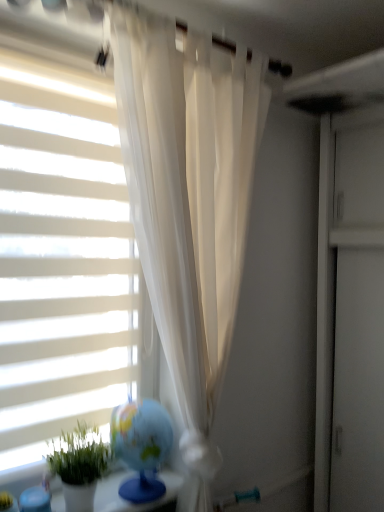
This screenshot has height=512, width=384. Describe the element at coordinates (61, 259) in the screenshot. I see `white matte window blind at left` at that location.

The height and width of the screenshot is (512, 384). Find the location of `white matte window blind at left`. white matte window blind at left is located at coordinates (61, 259).

Locate an element on the screen. green matte plant at lower left is located at coordinates (78, 466).

Image resolution: width=384 pixels, height=512 pixels. What do you see at coordinates (78, 466) in the screenshot? I see `green matte plant at lower left` at bounding box center [78, 466].

In order to face green matte plant at lower left, should I rotate leftwards or rightwards?

It's best to rotate left around 14.726 degrees.

The height and width of the screenshot is (512, 384). Find the location of `white matte window blind at left`. white matte window blind at left is located at coordinates (61, 259).

Visually, is white matte window blind at left positioned to the left or to the right of green matte plant at lower left?

Clearly, white matte window blind at left is on the left of green matte plant at lower left in the image.

Is white matte window blind at left in front of green matte plant at lower left?

No, it is not.

Is point (101, 157) closer or farther from the camera than point (110, 451)?

Point (101, 157) appears to be farther away from the viewer than point (110, 451).

From the image's perspective, which object appears higher, white matte window blind at left or green matte plant at lower left?

white matte window blind at left.

From a real-world perspective, which object rests below the other?

green matte plant at lower left is physically lower.

Is white matte window blind at left wider than green matte plant at lower left?

In fact, white matte window blind at left might be narrower than green matte plant at lower left.

Is white matte window blind at left taller than green matte plant at lower left?

Yes, white matte window blind at left is taller than green matte plant at lower left.

Between white matte window blind at left and green matte plant at lower left, which one has smaller size?

Smaller between the two is green matte plant at lower left.

Is green matte plant at lower left a part of white matte window blind at left?

Actually, green matte plant at lower left is outside white matte window blind at left.

Is white matte window blind at left far from green matte plant at lower left?

white matte window blind at left is actually quite close to green matte plant at lower left.

Does white matte window blind at left turn towards green matte plant at lower left?

Yes, white matte window blind at left is facing green matte plant at lower left.

From the picture: What's the angular difference between white matte window blind at left and green matte plant at lower left's facing directions?

0.484 degrees.

Where is `window blind that appears above the green matte plant at lower left (from a real-world perspective)`? The width and height of the screenshot is (384, 512). window blind that appears above the green matte plant at lower left (from a real-world perspective) is located at coordinates (61, 259).

Which object is positioned more to the right, green matte plant at lower left or white matte window blind at left?

Positioned to the right is green matte plant at lower left.

Which object is further away from the camera, green matte plant at lower left or white matte window blind at left?

white matte window blind at left.

Does point (72, 472) appear closer or farther from the camera than point (107, 262)?

Point (72, 472).

From the image's perspective, is green matte plant at lower left located beneath white matte window blind at left?

Indeed, from the image's perspective, green matte plant at lower left is shown beneath white matte window blind at left.

From a real-world perspective, is green matte plant at lower left located higher than white matte window blind at left?

Incorrect, from a real-world perspective, green matte plant at lower left is lower than white matte window blind at left.

Is green matte plant at lower left thinner than white matte window blind at left?

No.

Is green matte plant at lower left taller or shorter than white matte window blind at left?

green matte plant at lower left is shorter than white matte window blind at left.

Is green matte plant at lower left smaller than white matte window blind at left?

Yes.

Would you say white matte window blind at left is part of green matte plant at lower left's contents?

Actually, white matte window blind at left is outside green matte plant at lower left.

Would you consider green matte plant at lower left to be distant from white matte window blind at left?

That's not correct — green matte plant at lower left is a little close to white matte window blind at left.

Could you tell me if green matte plant at lower left is facing white matte window blind at left?

No, green matte plant at lower left does not turn towards white matte window blind at left.

How different are the orientations of green matte plant at lower left and white matte window blind at left in degrees?

The angular difference between green matte plant at lower left and white matte window blind at left is 0.484 degrees.

How distant is green matte plant at lower left from white matte window blind at left?

green matte plant at lower left is 15.81 inches away from white matte window blind at left.

You are a GUI agent. You are given a task and a screenshot of the screen. Output one action in this format:
    pyautogui.click(x=<x>, y=<y>)
    Task: Click on the window blind lying behind the green matte plant at lower left
    This screenshot has width=384, height=512.
    Given the screenshot: What is the action you would take?
    (x=61, y=259)

Find the location of `houseplant that appears on the right of white matte window blind at left`. houseplant that appears on the right of white matte window blind at left is located at coordinates (78, 466).

This screenshot has width=384, height=512. Identify the location of window blind that is behind the green matte plant at lower left. (61, 259).